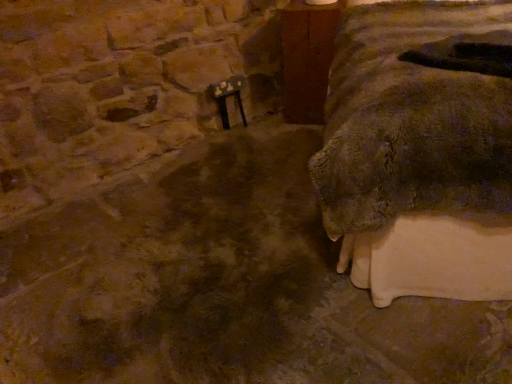
Measure the distance between point (441, 133) and camera.

Point (441, 133) is 1.10 meters away from camera.

This screenshot has width=512, height=384. What do you see at coordinates (418, 155) in the screenshot?
I see `fuzzy brown blanket at right` at bounding box center [418, 155].

You are a GUI agent. You are given a task and a screenshot of the screen. Output one action in this format:
    pyautogui.click(x=<x>, y=<y>)
    Task: Click on the fuzzy brown blanket at right
    The image size is (512, 384).
    Given the screenshot: What is the action you would take?
    pyautogui.click(x=418, y=155)

You are a GUI agent. You are given a task and a screenshot of the screen. Output one action in this format:
    pyautogui.click(x=<x>, y=<y>)
    Task: Click on the fuzzy brown blanket at right
    Image resolution: width=512 pixels, height=384 pixels.
    Given the screenshot: What is the action you would take?
    pyautogui.click(x=418, y=155)